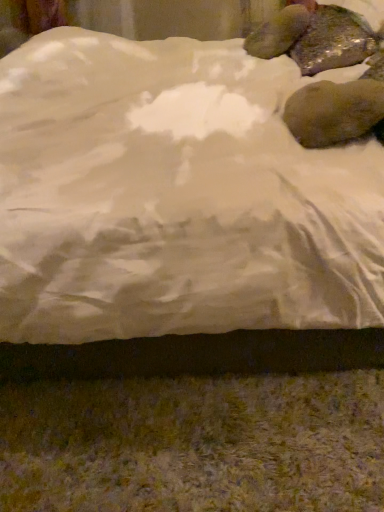
Question: Considering the relative sizes of brown matte rock at upper right and white satin bed at center in the image provided, is brown matte rock at upper right wider than white satin bed at center?

Choices:
 (A) yes
 (B) no

Answer: (B)

Question: Considering the relative positions of brown matte rock at upper right and white satin bed at center in the image provided, is brown matte rock at upper right to the right of white satin bed at center from the viewer's perspective?

Choices:
 (A) no
 (B) yes

Answer: (B)

Question: Would you say brown matte rock at upper right is a long distance from white satin bed at center?

Choices:
 (A) no
 (B) yes

Answer: (A)

Question: Does brown matte rock at upper right have a smaller size compared to white satin bed at center?

Choices:
 (A) yes
 (B) no

Answer: (A)

Question: Could you tell me if brown matte rock at upper right is facing white satin bed at center?

Choices:
 (A) yes
 (B) no

Answer: (A)

Question: Can you confirm if brown matte rock at upper right is bigger than white satin bed at center?

Choices:
 (A) no
 (B) yes

Answer: (A)

Question: From the image's perspective, is white satin bed at center below brown matte rock at upper right?

Choices:
 (A) no
 (B) yes

Answer: (A)

Question: From a real-world perspective, is white satin bed at center below brown matte rock at upper right?

Choices:
 (A) yes
 (B) no

Answer: (A)

Question: Is white satin bed at center at the right side of brown matte rock at upper right?

Choices:
 (A) yes
 (B) no

Answer: (B)

Question: Is white satin bed at center not inside brown matte rock at upper right?

Choices:
 (A) no
 (B) yes

Answer: (B)

Question: Considering the relative sizes of white satin bed at center and brown matte rock at upper right in the image provided, is white satin bed at center shorter than brown matte rock at upper right?

Choices:
 (A) no
 (B) yes

Answer: (A)

Question: From a real-world perspective, does white satin bed at center stand above brown matte rock at upper right?

Choices:
 (A) yes
 (B) no

Answer: (B)

Question: Is brown matte rock at upper right taller or shorter than white satin bed at center?

Choices:
 (A) short
 (B) tall

Answer: (A)